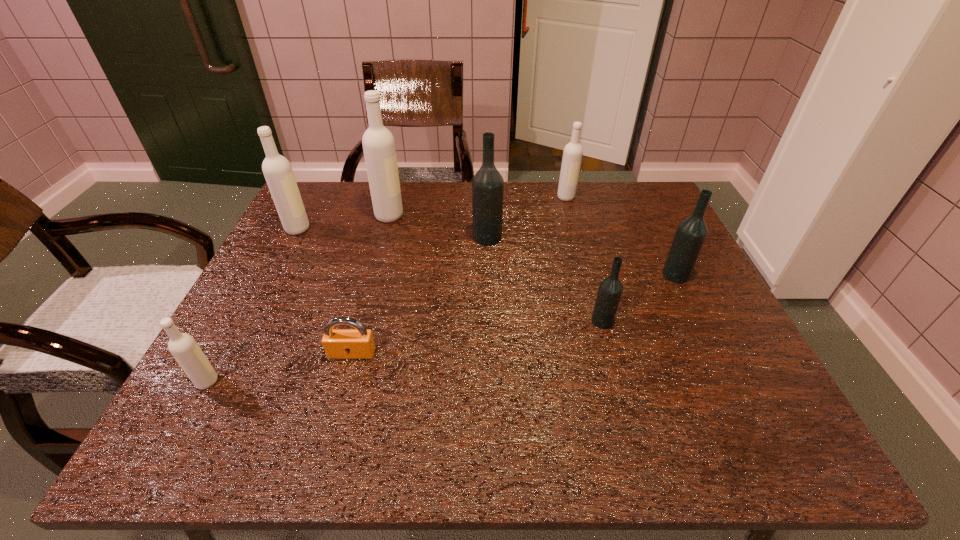
The height and width of the screenshot is (540, 960). I want to click on the nearest white vodka, so click(183, 347).

Find the location of `the second black vodka from left to right`. the second black vodka from left to right is located at coordinates (610, 289).

Locate an element on the screen. The width and height of the screenshot is (960, 540). the smallest black vodka is located at coordinates (610, 289).

This screenshot has width=960, height=540. In order to click on the shortest object in this screenshot , I will do `click(358, 343)`.

Locate an element on the screen. padlock is located at coordinates (358, 343).

You are a GUI agent. You are given a task and a screenshot of the screen. Output one action in this format:
    pyautogui.click(x=<x>, y=<y>)
    Task: Click on the free region located on the left of the second white vodka from right to left
    The width and height of the screenshot is (960, 540).
    Given the screenshot: What is the action you would take?
    pyautogui.click(x=328, y=215)

Where is `vacant space located on the left of the leftmost black vodka`? This screenshot has width=960, height=540. vacant space located on the left of the leftmost black vodka is located at coordinates (426, 238).

At what (x,y) coordinates should I click in order to perform the action: click on free space located on the right of the second biggest white vodka. Please return your answer as a coordinate pair (x, y). Looking at the image, I should click on (363, 229).

Identify the location of vacant region located 0.050m on the right of the rightmost white vodka. Image resolution: width=960 pixels, height=540 pixels. (591, 197).

You are a GUI agent. You are given a task and a screenshot of the screen. Output one action in this format:
    pyautogui.click(x=<x>, y=<y>)
    Task: Click on the vacant space located 0.360m on the left of the fourth nearest object
    The height and width of the screenshot is (540, 960).
    Given the screenshot: What is the action you would take?
    pyautogui.click(x=519, y=275)